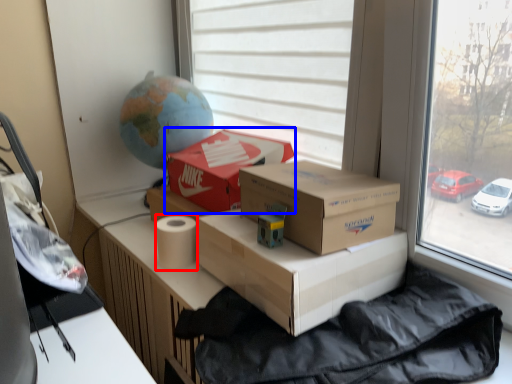
Question: Which object appears closest to the camera in this image, toilet paper (highlighted by a red box) or box (highlighted by a blue box)?

Choices:
 (A) toilet paper
 (B) box

Answer: (A)